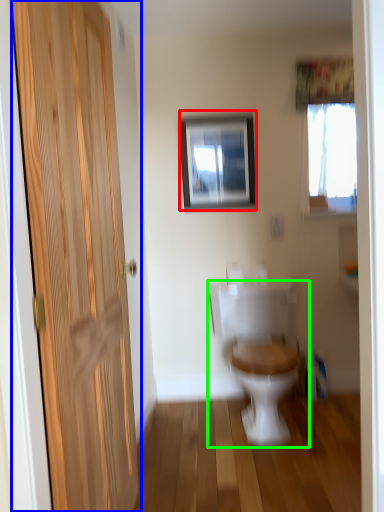
Question: Considering the real-world distances, which object is farthest from picture frame (highlighted by a red box)? door (highlighted by a blue box) or toilet (highlighted by a green box)?

Choices:
 (A) door
 (B) toilet

Answer: (A)